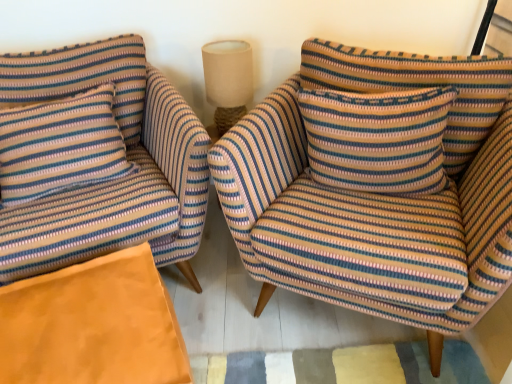
Question: From a real-world perspective, is beige fabric lampshade at upper center located higher than striped fabric pillow at center, marked as the 1th pillow in a right-to-left arrangement?

Choices:
 (A) yes
 (B) no

Answer: (B)

Question: Does beige fabric lampshade at upper center have a greater height compared to striped fabric pillow at center, marked as the 1th pillow in a right-to-left arrangement?

Choices:
 (A) yes
 (B) no

Answer: (A)

Question: Can you see beige fabric lampshade at upper center touching striped fabric pillow at center, marked as the 1th pillow in a right-to-left arrangement?

Choices:
 (A) yes
 (B) no

Answer: (B)

Question: Is beige fabric lampshade at upper center smaller than striped fabric pillow at center, which is the 2th pillow from left to right?

Choices:
 (A) no
 (B) yes

Answer: (B)

Question: From a real-world perspective, is beige fabric lampshade at upper center under striped fabric pillow at center, marked as the 1th pillow in a right-to-left arrangement?

Choices:
 (A) no
 (B) yes

Answer: (B)

Question: Would you say striped fabric pillow at center, marked as the 1th pillow in a right-to-left arrangement, is part of beige fabric lampshade at upper center's contents?

Choices:
 (A) yes
 (B) no

Answer: (B)

Question: Is striped fabric pillow at left, which appears as the second pillow when viewed from the right, at the back of orange suede ottoman at lower left?

Choices:
 (A) no
 (B) yes

Answer: (B)

Question: From a real-world perspective, is orange suede ottoman at lower left under striped fabric pillow at left, positioned as the first pillow in left-to-right order?

Choices:
 (A) no
 (B) yes

Answer: (B)

Question: From the image's perspective, is orange suede ottoman at lower left below striped fabric pillow at left, which appears as the second pillow when viewed from the right?

Choices:
 (A) yes
 (B) no

Answer: (A)

Question: Can striped fabric pillow at left, positioned as the first pillow in left-to-right order, be found inside orange suede ottoman at lower left?

Choices:
 (A) yes
 (B) no

Answer: (B)

Question: Is orange suede ottoman at lower left wider than striped fabric pillow at left, positioned as the first pillow in left-to-right order?

Choices:
 (A) no
 (B) yes

Answer: (B)

Question: Could you tell me if orange suede ottoman at lower left is turned towards striped fabric pillow at left, which appears as the second pillow when viewed from the right?

Choices:
 (A) no
 (B) yes

Answer: (A)

Question: Could you tell me if orange suede ottoman at lower left is facing striped fabric armchair at center, marked as the 1th chair in a right-to-left arrangement?

Choices:
 (A) no
 (B) yes

Answer: (A)